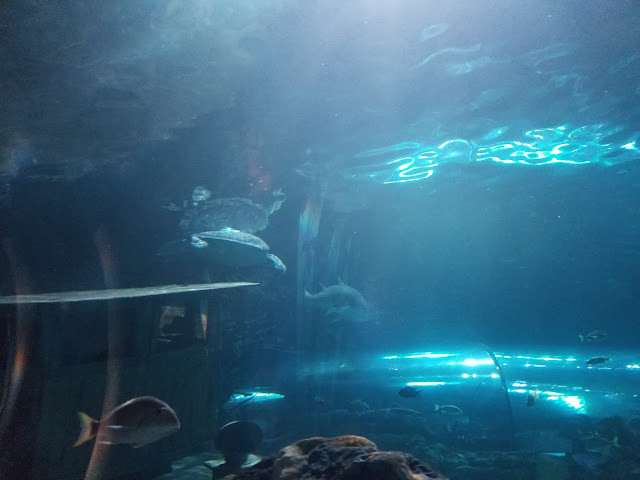
Find the location of a particular element. window is located at coordinates (86, 347), (170, 327).